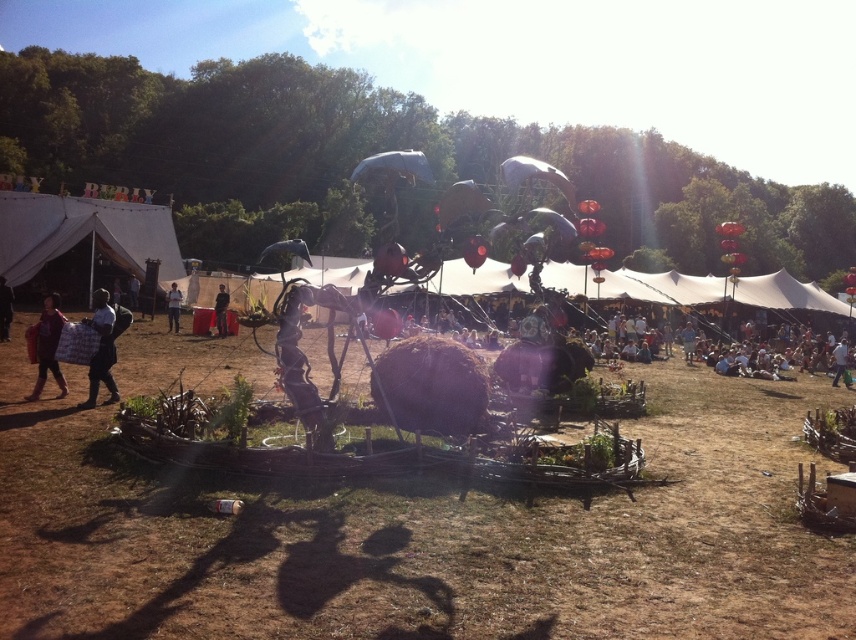
Based on the scene description, which object is wider, the matte red bag at lower left or the metallic silver figure at center?

The matte red bag at lower left is wider than the metallic silver figure at center according to the description.

You are at the festival and want to find the light blue fabric at center. Which direction should you move from the white canvas tent at upper left to locate it?

The light blue fabric at center is to the right of the white canvas tent at upper left, so you should move to the right to locate it.

You are at the festival and want to take a photo of the metallic silver figure at center without any obstructions. Is the black fabric at left blocking your view of it?

The black fabric at left is in front of the metallic silver figure at center, so it is blocking your view of the metallic silver figure at center. You would need to move around the black fabric at left to get an unobstructed photo.